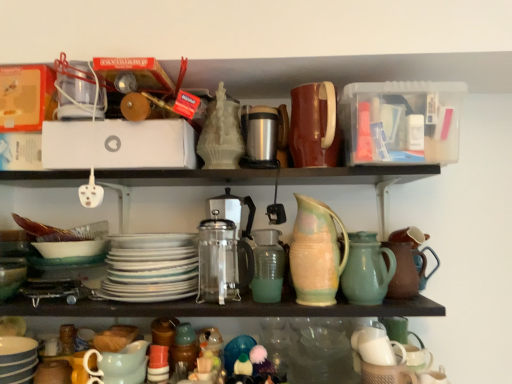
Where is `brown matte tea pot at right`? The width and height of the screenshot is (512, 384). brown matte tea pot at right is located at coordinates [x=406, y=262].

Where is `matte ceramic pitcher at lower left, arranged as the first tableware when ordered from the bottom`? This screenshot has width=512, height=384. matte ceramic pitcher at lower left, arranged as the first tableware when ordered from the bottom is located at coordinates (119, 365).

Identify the location of white glossy platter at center. (151, 268).

Describe the element at coordinates (17, 359) in the screenshot. I see `striped ceramic bowls at lower left, acting as the second tableware starting from the bottom` at that location.

This screenshot has height=384, width=512. Find the location of `translucent glass vase at center`. translucent glass vase at center is located at coordinates (267, 266).

Locate an element on the screen. Image resolution: width=512 pixels, height=384 pixels. teal ceramic jug at center-right, the 1th jug when ordered from right to left is located at coordinates (367, 269).

From the image's perspective, is brown ceramic pitcher at upper center, placed as the first tableware when sorted from top to bottom, beneath matte green mixing bowl at lower left?

No, from the image's perspective, brown ceramic pitcher at upper center, placed as the first tableware when sorted from top to bottom, is not below matte green mixing bowl at lower left.

Which of these two, brown ceramic pitcher at upper center, which ranks as the 3th tableware in bottom-to-top order, or matte green mixing bowl at lower left, is smaller?

Smaller between the two is matte green mixing bowl at lower left.

This screenshot has width=512, height=384. Find the location of `tableware above the matte green mixing bowl at lower left (from the image's perspective)`. tableware above the matte green mixing bowl at lower left (from the image's perspective) is located at coordinates (314, 125).

Which object is closer to the camera taking this photo, brown ceramic pitcher at upper center, placed as the first tableware when sorted from top to bottom, or matte green mixing bowl at lower left?

brown ceramic pitcher at upper center, placed as the first tableware when sorted from top to bottom, is more forward.

Between satin silver coffee machine at center and teal ceramic jug at center-right, acting as the second jug starting from the left, which one appears on the right side from the viewer's perspective?

From the viewer's perspective, teal ceramic jug at center-right, acting as the second jug starting from the left, appears more on the right side.

Is point (203, 272) closer or farther from the camera than point (353, 236)?

Point (203, 272).

Considering the sizes of objects satin silver coffee machine at center and teal ceramic jug at center-right, the 1th jug when ordered from right to left, in the image provided, who is thinner, satin silver coffee machine at center or teal ceramic jug at center-right, the 1th jug when ordered from right to left,?

With smaller width is teal ceramic jug at center-right, the 1th jug when ordered from right to left.

Looking at this image, is satin silver coffee machine at center inside or outside of teal ceramic jug at center-right, the 1th jug when ordered from right to left?

satin silver coffee machine at center is spatially situated outside teal ceramic jug at center-right, the 1th jug when ordered from right to left.

Are white glossy platter at center and teal ceramic jug at center-right, the 1th jug when ordered from right to left, located far from each other?

No, white glossy platter at center is in close proximity to teal ceramic jug at center-right, the 1th jug when ordered from right to left.

Can you confirm if white glossy platter at center is bigger than teal ceramic jug at center-right, acting as the second jug starting from the left?

Indeed, white glossy platter at center has a larger size compared to teal ceramic jug at center-right, acting as the second jug starting from the left.

From a real-world perspective, who is located lower, white glossy platter at center or teal ceramic jug at center-right, acting as the second jug starting from the left?

teal ceramic jug at center-right, acting as the second jug starting from the left, is physically lower.

How different are the orientations of white glossy platter at center and teal ceramic jug at center-right, the 1th jug when ordered from right to left, in degrees?

They differ by 4.98 degrees in their facing directions.

Considering the sizes of objects matte green mixing bowl at lower left and striped ceramic bowls at lower left, the third tableware positioned from the right, in the image provided, who is smaller, matte green mixing bowl at lower left or striped ceramic bowls at lower left, the third tableware positioned from the right,?

Smaller between the two is matte green mixing bowl at lower left.

What's the angular difference between matte green mixing bowl at lower left and striped ceramic bowls at lower left, acting as the second tableware starting from the bottom,'s facing directions?

There is a 0.00077-degree angle between the facing directions of matte green mixing bowl at lower left and striped ceramic bowls at lower left, acting as the second tableware starting from the bottom.

Is matte green mixing bowl at lower left far from striped ceramic bowls at lower left, marked as the 1th tableware in a left-to-right arrangement?

They are positioned close to each other.

Considering the positions of objects matte green mixing bowl at lower left and striped ceramic bowls at lower left, acting as the second tableware starting from the bottom, in the image provided, who is more to the left, matte green mixing bowl at lower left or striped ceramic bowls at lower left, acting as the second tableware starting from the bottom,?

matte green mixing bowl at lower left is more to the left.

Are matte ceramic pitcher at lower left, marked as the second tableware in a right-to-left arrangement, and brown matte tea pot at right beside each other?

matte ceramic pitcher at lower left, marked as the second tableware in a right-to-left arrangement, is not next to brown matte tea pot at right, and they're not touching.

Can you confirm if matte ceramic pitcher at lower left, the 3th tableware in the top-to-bottom sequence, is positioned to the right of brown matte tea pot at right?

No.

Is matte ceramic pitcher at lower left, the 3th tableware in the top-to-bottom sequence, looking in the opposite direction of brown matte tea pot at right?

No, matte ceramic pitcher at lower left, the 3th tableware in the top-to-bottom sequence, is not facing away from brown matte tea pot at right.

Can you confirm if matte ceramic pitcher at lower left, the 3th tableware in the top-to-bottom sequence, is bigger than brown matte tea pot at right?

Actually, matte ceramic pitcher at lower left, the 3th tableware in the top-to-bottom sequence, might be smaller than brown matte tea pot at right.

Is teal ceramic jug at center-right, acting as the second jug starting from the left, oriented towards matte ceramic pitcher at lower left, the 3th tableware in the top-to-bottom sequence?

No, teal ceramic jug at center-right, acting as the second jug starting from the left, is not facing towards matte ceramic pitcher at lower left, the 3th tableware in the top-to-bottom sequence.

Is teal ceramic jug at center-right, the 1th jug when ordered from right to left, at the right side of matte ceramic pitcher at lower left, the 3th tableware in the top-to-bottom sequence?

Yes.

From the image's perspective, is teal ceramic jug at center-right, the 1th jug when ordered from right to left, under matte ceramic pitcher at lower left, the 3th tableware in the top-to-bottom sequence?

Incorrect, from the image's perspective, teal ceramic jug at center-right, the 1th jug when ordered from right to left, is higher than matte ceramic pitcher at lower left, the 3th tableware in the top-to-bottom sequence.

Does teal ceramic jug at center-right, acting as the second jug starting from the left, have a greater height compared to matte ceramic pitcher at lower left, arranged as the first tableware when ordered from the bottom?

Correct, teal ceramic jug at center-right, acting as the second jug starting from the left, is much taller as matte ceramic pitcher at lower left, arranged as the first tableware when ordered from the bottom.

Considering the relative positions of pastel glazed pitcher at center, which is the 2th jug from right to left, and striped ceramic bowls at lower left, which ranks as the 2th tableware in top-to-bottom order, in the image provided, is pastel glazed pitcher at center, which is the 2th jug from right to left, to the right of striped ceramic bowls at lower left, which ranks as the 2th tableware in top-to-bottom order, from the viewer's perspective?

Yes, pastel glazed pitcher at center, which is the 2th jug from right to left, is to the right of striped ceramic bowls at lower left, which ranks as the 2th tableware in top-to-bottom order.

Can you confirm if pastel glazed pitcher at center, which is the 2th jug from right to left, is shorter than striped ceramic bowls at lower left, the third tableware positioned from the right?

No, pastel glazed pitcher at center, which is the 2th jug from right to left, is not shorter than striped ceramic bowls at lower left, the third tableware positioned from the right.

Find the location of `the 1st jug to the right of the striped ceramic bowls at lower left, the third tableware positioned from the right, starting your count from the anchor`. the 1st jug to the right of the striped ceramic bowls at lower left, the third tableware positioned from the right, starting your count from the anchor is located at coordinates [316, 253].

Can you tell me how much pastel glazed pitcher at center, the first jug from the left, and striped ceramic bowls at lower left, which ranks as the 2th tableware in top-to-bottom order, differ in facing direction?

They differ by 4.98 degrees in their facing directions.

Image resolution: width=512 pixels, height=384 pixels. I want to click on tableware above the matte green mixing bowl at lower left (from the image's perspective), so click(314, 125).

The image size is (512, 384). I want to click on coffee machine below the teal ceramic jug at center-right, the 1th jug when ordered from right to left (from the image's perspective), so click(224, 249).

Considering their positions, is striped ceramic bowls at lower left, acting as the second tableware starting from the bottom, positioned further to brown matte tea pot at right than satin silver coffee machine at center?

striped ceramic bowls at lower left, acting as the second tableware starting from the bottom.

Consider the image. Looking at the image, which one is located closer to translucent glass vase at center, translucent glass cups at lower center or brown matte tea pot at right?

Among the two, translucent glass cups at lower center is located nearer to translucent glass vase at center.

Which object lies nearer to the anchor point striped ceramic bowls at lower left, marked as the 1th tableware in a left-to-right arrangement, teal ceramic jug at center-right, acting as the second jug starting from the left, or matte green mixing bowl at lower left?

Among the two, matte green mixing bowl at lower left is located nearer to striped ceramic bowls at lower left, marked as the 1th tableware in a left-to-right arrangement.

When comparing their distances from pastel glazed pitcher at center, which is the 2th jug from right to left, does brown ceramic pitcher at upper center, placed as the third tableware when sorted from left to right, or matte ceramic pitcher at lower left, marked as the second tableware in a right-to-left arrangement, seem closer?

Based on the image, brown ceramic pitcher at upper center, placed as the third tableware when sorted from left to right, appears to be nearer to pastel glazed pitcher at center, which is the 2th jug from right to left.

Estimate the real-world distances between objects in this image. Which object is closer to matte green mixing bowl at lower left, teal ceramic jug at center-right, the 1th jug when ordered from right to left, or translucent glass cups at lower center?

translucent glass cups at lower center is closer to matte green mixing bowl at lower left.

Estimate the real-world distances between objects in this image. Which object is further from striped ceramic bowls at lower left, which ranks as the 2th tableware in top-to-bottom order, matte ceramic pitcher at lower left, the 3th tableware in the top-to-bottom sequence, or teal ceramic jug at center-right, acting as the second jug starting from the left?

The object further to striped ceramic bowls at lower left, which ranks as the 2th tableware in top-to-bottom order, is teal ceramic jug at center-right, acting as the second jug starting from the left.

Considering their positions, is pastel glazed pitcher at center, the first jug from the left, positioned further to brown matte tea pot at right than translucent glass vase at center?

translucent glass vase at center is further to brown matte tea pot at right.

Based on their spatial positions, is brown ceramic pitcher at upper center, placed as the third tableware when sorted from left to right, or brown matte tea pot at right closer to satin silver coffee machine at center?

brown ceramic pitcher at upper center, placed as the third tableware when sorted from left to right, lies closer to satin silver coffee machine at center than the other object.

Locate an element on the screen. This screenshot has width=512, height=384. shelf situated between matte ceramic pitcher at lower left, arranged as the first tableware when ordered from the bottom, and brown matte tea pot at right from left to right is located at coordinates (306, 346).

At what (x,y) coordinates should I click in order to perform the action: click on shelf between matte green mixing bowl at lower left and teal ceramic jug at center-right, acting as the second jug starting from the left, in the horizontal direction. Please return your answer as a coordinate pair (x, y). The image size is (512, 384). Looking at the image, I should click on (306, 346).

The image size is (512, 384). In order to click on shelf between striped ceramic bowls at lower left, the third tableware positioned from the right, and brown matte tea pot at right from left to right in this screenshot , I will do `click(306, 346)`.

The image size is (512, 384). Identify the location of pottery situated between satin silver coffee machine at center and teal ceramic jug at center-right, acting as the second jug starting from the left, from left to right. (267, 266).